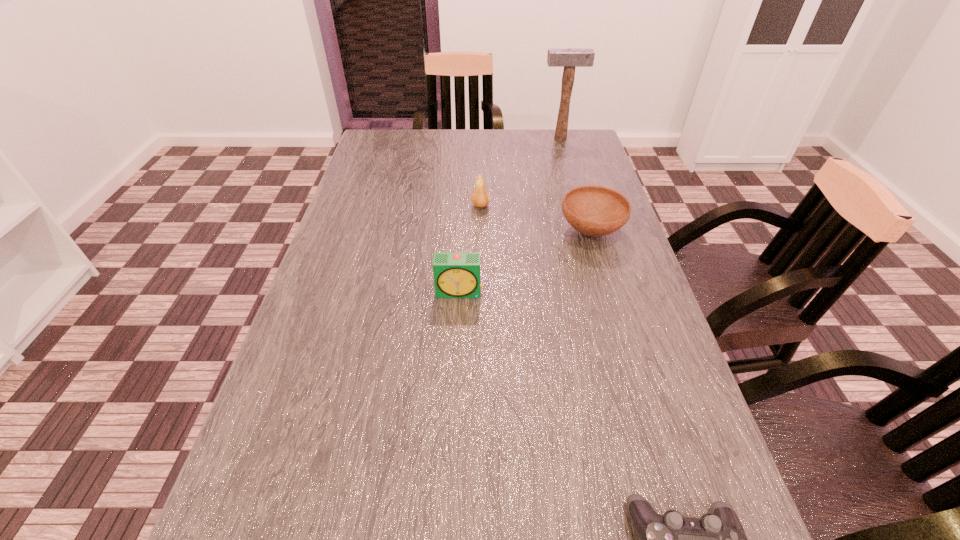
This screenshot has height=540, width=960. Identify the location of object identified as the second closest to the pear. (456, 274).

Find the location of a particular element. This screenshot has width=960, height=540. object that ranks as the closest to the fourth farthest object is located at coordinates click(x=592, y=210).